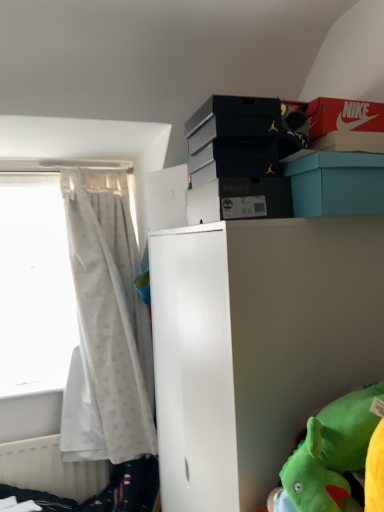
Question: From a real-world perspective, is teal cardboard box at upper center, which appears as the second storage box when ordered from the bottom, on top of white matte cabinet at center?

Choices:
 (A) no
 (B) yes

Answer: (B)

Question: Is teal cardboard box at upper center, the fourth storage box viewed from the top, turned away from white matte cabinet at center?

Choices:
 (A) yes
 (B) no

Answer: (B)

Question: Is teal cardboard box at upper center, which appears as the second storage box when ordered from the bottom, bigger than white matte cabinet at center?

Choices:
 (A) yes
 (B) no

Answer: (B)

Question: Can you confirm if teal cardboard box at upper center, which appears as the second storage box when ordered from the bottom, is taller than white matte cabinet at center?

Choices:
 (A) yes
 (B) no

Answer: (B)

Question: Does teal cardboard box at upper center, the fourth storage box viewed from the top, have a lesser height compared to white matte cabinet at center?

Choices:
 (A) no
 (B) yes

Answer: (B)

Question: In the image, is white matte cabinet at center on the left side or the right side of white glossy bed frame at lower left?

Choices:
 (A) right
 (B) left

Answer: (A)

Question: Based on their sizes in the image, would you say white matte cabinet at center is bigger or smaller than white glossy bed frame at lower left?

Choices:
 (A) big
 (B) small

Answer: (A)

Question: From their relative heights in the image, would you say white matte cabinet at center is taller or shorter than white glossy bed frame at lower left?

Choices:
 (A) short
 (B) tall

Answer: (B)

Question: From the image's perspective, is white matte cabinet at center positioned above or below white glossy bed frame at lower left?

Choices:
 (A) below
 (B) above

Answer: (B)

Question: Is white sheer curtain at left in front of or behind black matte shoebox at upper center, arranged as the 3th storage box when viewed from the top, in the image?

Choices:
 (A) front
 (B) behind

Answer: (B)

Question: In the image, is white sheer curtain at left on the left side or the right side of black matte shoebox at upper center, which appears as the third storage box when ordered from the bottom?

Choices:
 (A) right
 (B) left

Answer: (B)

Question: Is point (130, 219) positioned closer to the camera than point (276, 158)?

Choices:
 (A) closer
 (B) farther

Answer: (B)

Question: Is white sheer curtain at left bigger or smaller than black matte shoebox at upper center, arranged as the 3th storage box when viewed from the top?

Choices:
 (A) big
 (B) small

Answer: (A)

Question: From a real-world perspective, is black matte shoebox at upper center, which appears as the 5th storage box when viewed from the top, positioned above or below teal cardboard box at upper center, which appears as the second storage box when ordered from the bottom?

Choices:
 (A) above
 (B) below

Answer: (B)

Question: Considering the relative positions of black matte shoebox at upper center, acting as the 1th storage box starting from the bottom, and teal cardboard box at upper center, the fourth storage box viewed from the top, in the image provided, is black matte shoebox at upper center, acting as the 1th storage box starting from the bottom, to the left or to the right of teal cardboard box at upper center, the fourth storage box viewed from the top,?

Choices:
 (A) left
 (B) right

Answer: (A)